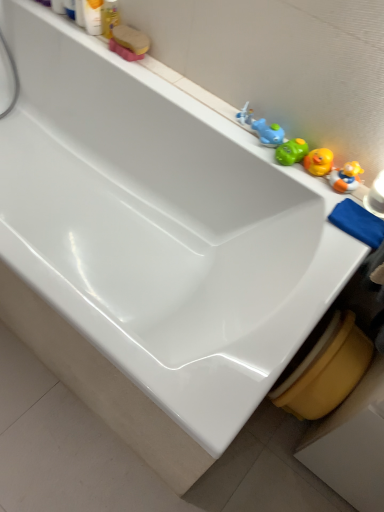
This screenshot has width=384, height=512. In order to click on free space in front of yellow matte plastic toilet bowl at lower right in this screenshot , I will do (276, 465).